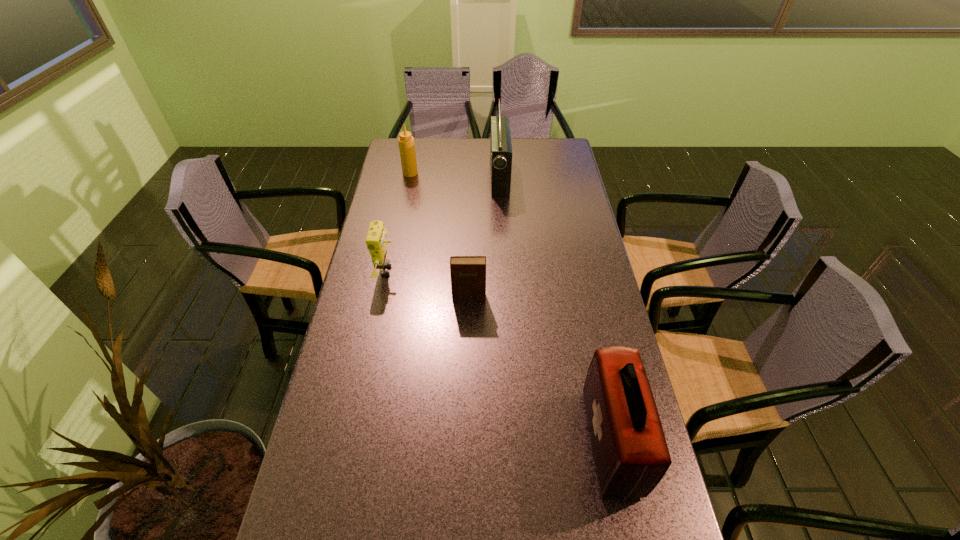
At what (x,y) coordinates should I click in order to perform the action: click on the second object from right to left. Please return your answer as a coordinate pair (x, y). The image size is (960, 540). Looking at the image, I should click on (500, 145).

Where is `the first aid kit`? This screenshot has height=540, width=960. the first aid kit is located at coordinates (631, 455).

The width and height of the screenshot is (960, 540). What are the coordinates of `the nearest object` in the screenshot? It's located at (631, 455).

Find the location of a particular element. This screenshot has width=960, height=540. condiment is located at coordinates (406, 141).

The width and height of the screenshot is (960, 540). Find the location of `sponge`. sponge is located at coordinates (375, 240).

In order to click on the third object from right to left in this screenshot , I will do `click(468, 273)`.

I want to click on free location located 0.110m on the front-facing side of the radio receiver, so click(464, 177).

This screenshot has height=540, width=960. What are the coordinates of `vacant space located on the front-facing side of the radio receiver` in the screenshot? It's located at (459, 177).

At what (x,y) coordinates should I click in order to perform the action: click on vacant region located 0.400m on the front-facing side of the radio receiver. Please return your answer as a coordinate pair (x, y). The height and width of the screenshot is (540, 960). Looking at the image, I should click on (395, 177).

This screenshot has width=960, height=540. Identify the location of vacant space located on the side of the rightmost object with the cross symbol. click(x=567, y=442).